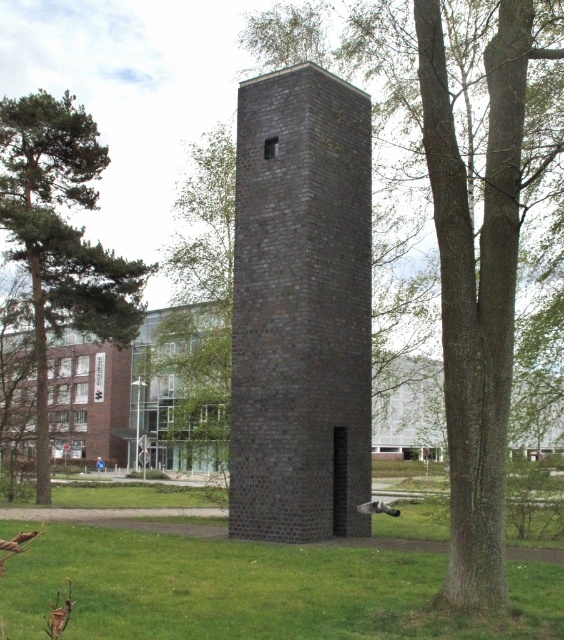
Question: Is green grass at center above smooth bark tree at center?

Choices:
 (A) yes
 (B) no

Answer: (B)

Question: Which point is farther to the camera?

Choices:
 (A) dark gray brick tower at center
 (B) green grass at center
 (C) smooth bark tree at center
 (D) green leafy tree at left

Answer: (D)

Question: Is dark gray brick tower at center positioned behind smooth bark tree at center?

Choices:
 (A) yes
 (B) no

Answer: (A)

Question: Which object is positioned closest to the green leafy tree at left?

Choices:
 (A) green grass at center
 (B) smooth bark tree at center

Answer: (A)

Question: Which is nearer to the smooth bark tree at center?

Choices:
 (A) dark gray brick tower at center
 (B) green grass at center

Answer: (A)

Question: Does green grass at center appear on the right side of green leafy tree at left?

Choices:
 (A) yes
 (B) no

Answer: (A)